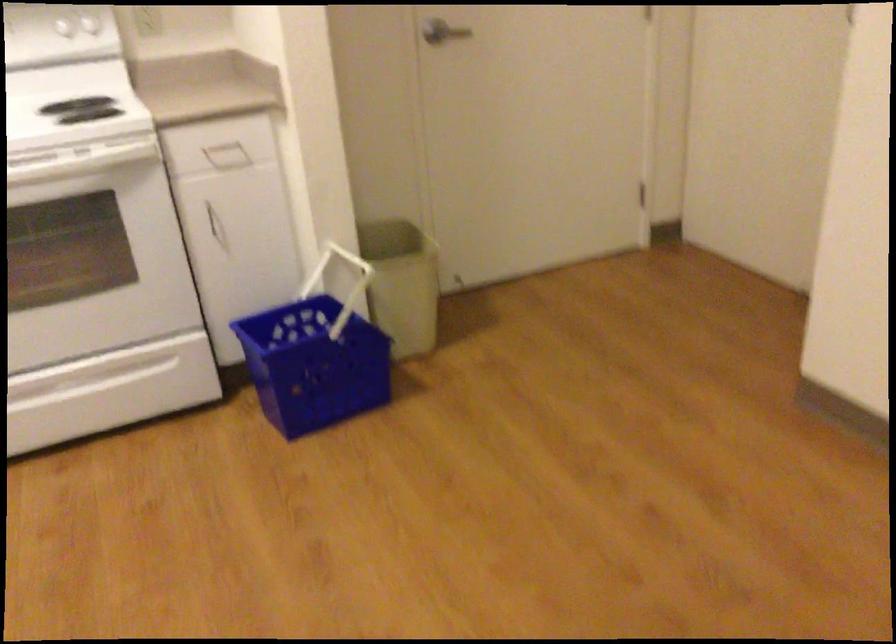
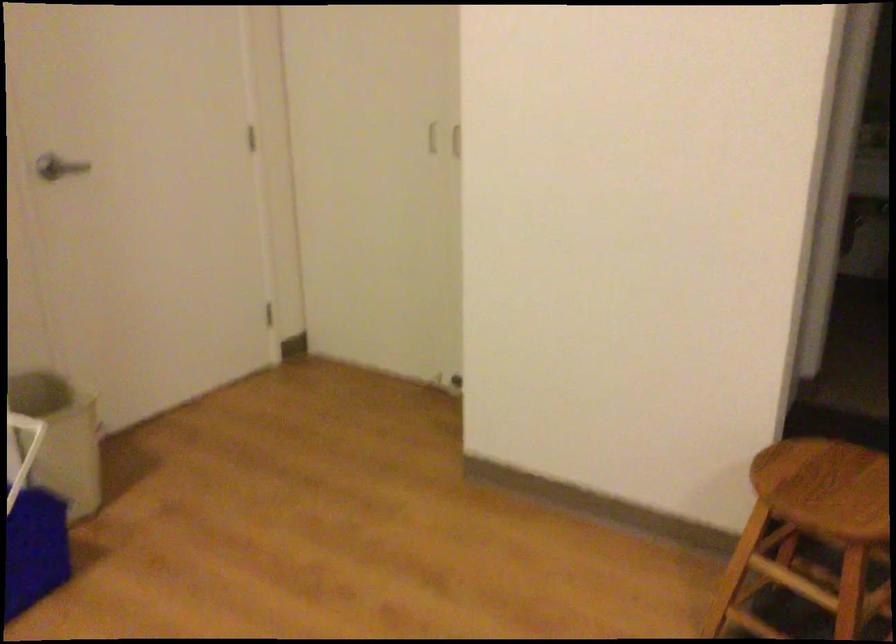
Question: The camera is either moving clockwise (left) or counter-clockwise (right) around the object. The first image is from the beginning of the video and the second image is from the end. Is the camera moving left or right when shooting the video?

Choices:
 (A) Left
 (B) Right

Answer: (A)